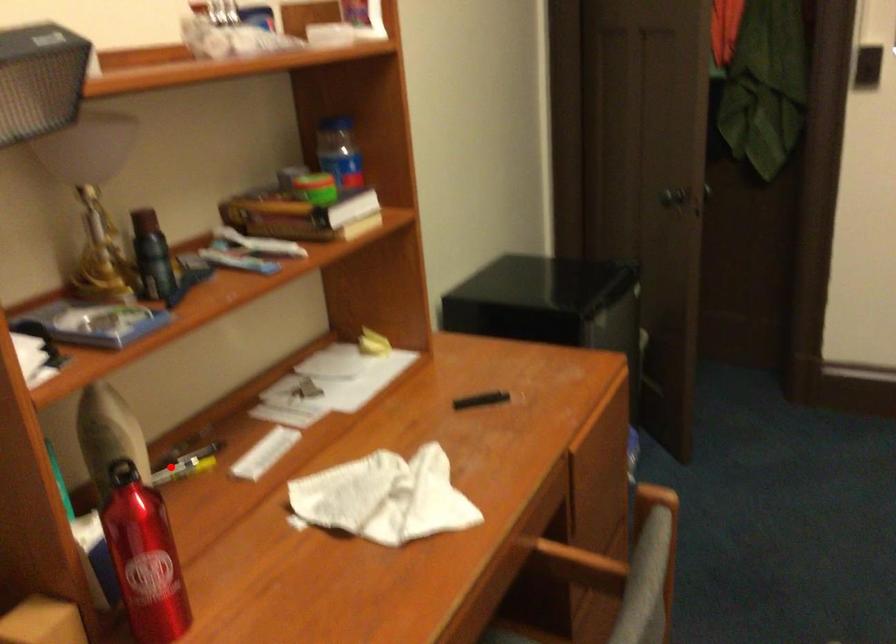
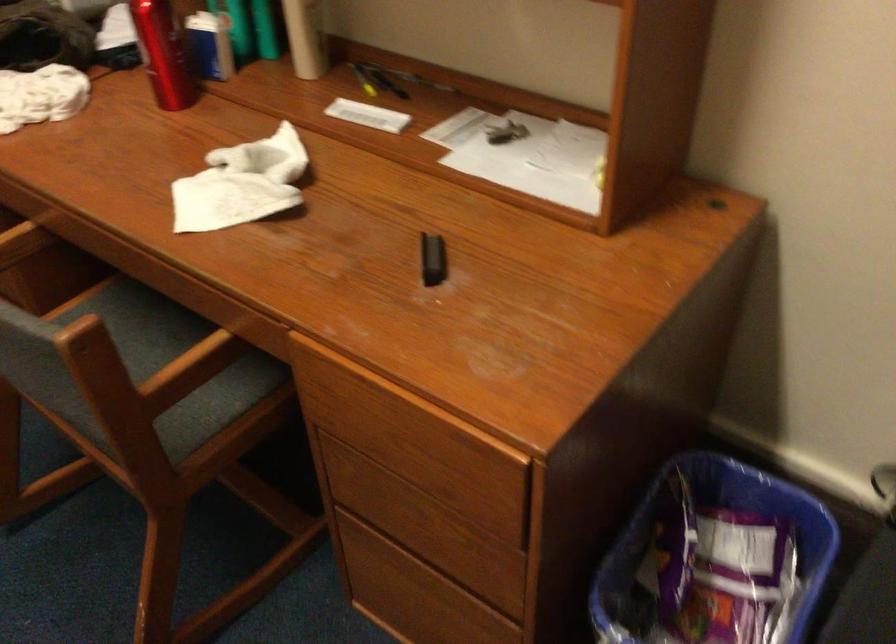
Locate, in the second image, the point that corresponds to the highlighted location in the first image.

(376, 80)